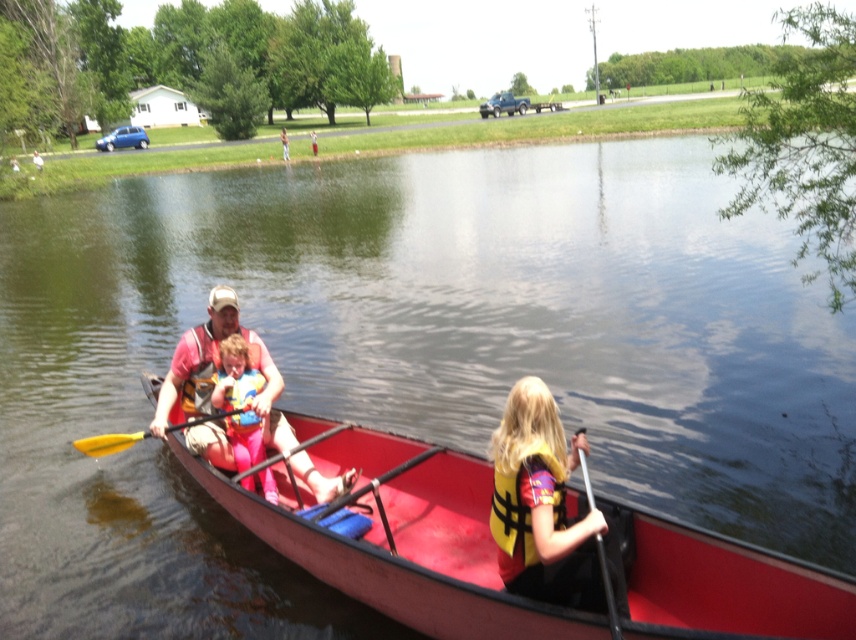
Question: Can you confirm if red plastic canoe at center is positioned to the right of yellow wood paddle at left?

Choices:
 (A) no
 (B) yes

Answer: (B)

Question: Can you confirm if matte pink life vest at center is positioned above black plastic paddle at lower right?

Choices:
 (A) no
 (B) yes

Answer: (B)

Question: Which object is the farthest from the pink fabric life vest at center?

Choices:
 (A) yellow fabric life jacket at lower right
 (B) red plastic canoe at center
 (C) yellow life vest at center
 (D) yellow wood paddle at left

Answer: (C)

Question: Which object is farther from the camera taking this photo?

Choices:
 (A) yellow wood paddle at left
 (B) pink fabric life vest at center

Answer: (A)

Question: Which object is farther from the camera taking this photo?

Choices:
 (A) pink fabric life vest at center
 (B) yellow wood paddle at left
 (C) yellow life vest at center

Answer: (B)

Question: Where is red plastic canoe at center located in relation to yellow fabric life jacket at lower right in the image?

Choices:
 (A) left
 (B) right

Answer: (A)